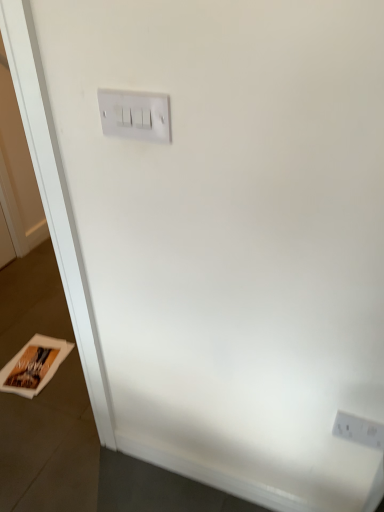
Question: Would you say white glossy magazine at lower left is a long distance from white plastic power plugs and sockets at lower right?

Choices:
 (A) yes
 (B) no

Answer: (A)

Question: From the image's perspective, does white glossy magazine at lower left appear higher than white plastic power plugs and sockets at lower right?

Choices:
 (A) no
 (B) yes

Answer: (A)

Question: Is white glossy magazine at lower left to the right of white plastic power plugs and sockets at lower right from the viewer's perspective?

Choices:
 (A) no
 (B) yes

Answer: (A)

Question: Is white glossy magazine at lower left in front of white plastic power plugs and sockets at lower right?

Choices:
 (A) yes
 (B) no

Answer: (B)

Question: Is white plastic power plugs and sockets at lower right at the back of white glossy magazine at lower left?

Choices:
 (A) yes
 (B) no

Answer: (B)

Question: Considering the relative sizes of white glossy magazine at lower left and white plastic power plugs and sockets at lower right in the image provided, is white glossy magazine at lower left taller than white plastic power plugs and sockets at lower right?

Choices:
 (A) yes
 (B) no

Answer: (B)

Question: Can you confirm if white plastic power plugs and sockets at lower right is wider than white glossy magazine at lower left?

Choices:
 (A) no
 (B) yes

Answer: (A)

Question: Considering the relative sizes of white plastic power plugs and sockets at lower right and white glossy magazine at lower left in the image provided, is white plastic power plugs and sockets at lower right thinner than white glossy magazine at lower left?

Choices:
 (A) yes
 (B) no

Answer: (A)

Question: Does white plastic power plugs and sockets at lower right turn towards white glossy magazine at lower left?

Choices:
 (A) no
 (B) yes

Answer: (A)

Question: From a real-world perspective, is white plastic power plugs and sockets at lower right located higher than white glossy magazine at lower left?

Choices:
 (A) no
 (B) yes

Answer: (B)

Question: Would you consider white plastic power plugs and sockets at lower right to be distant from white glossy magazine at lower left?

Choices:
 (A) no
 (B) yes

Answer: (B)

Question: Would you say white glossy magazine at lower left is part of white plastic power plugs and sockets at lower right's contents?

Choices:
 (A) yes
 (B) no

Answer: (B)

Question: From the image's perspective, is white glossy magazine at lower left located above or below white plastic power plugs and sockets at lower right?

Choices:
 (A) below
 (B) above

Answer: (A)